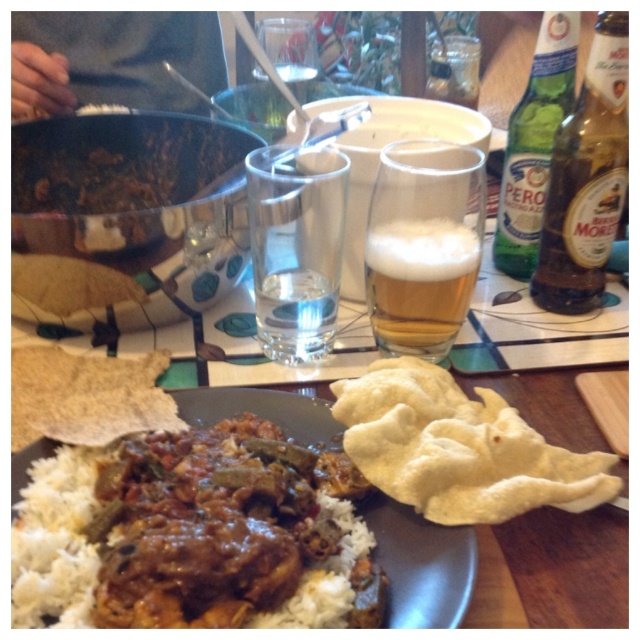
Question: Which of the following is the farthest from the observer?

Choices:
 (A) green glass bottle at upper right
 (B) brown glass bottle at upper right
 (C) white matte rice at lower left

Answer: (A)

Question: From the image, what is the correct spatial relationship of brown glass bottle at upper right in relation to foamy golden beer at center?

Choices:
 (A) above
 (B) below

Answer: (A)

Question: Which is nearer to the brown glass bottle at upper right?

Choices:
 (A) white matte rice at lower left
 (B) clear glass water at center
 (C) foamy golden beer at center

Answer: (C)

Question: Can you confirm if white matte rice at lower left is smaller than white soft flatbread at lower left?

Choices:
 (A) yes
 (B) no

Answer: (B)

Question: Is white fluffy flatbread at lower right to the right of foamy golden beer at center from the viewer's perspective?

Choices:
 (A) yes
 (B) no

Answer: (A)

Question: Estimate the real-world distances between objects in this image. Which object is closer to the foamy golden beer at center?

Choices:
 (A) white soft flatbread at lower left
 (B) brown glass bottle at upper right
 (C) white fluffy flatbread at lower right
 (D) green glass bottle at upper right

Answer: (C)